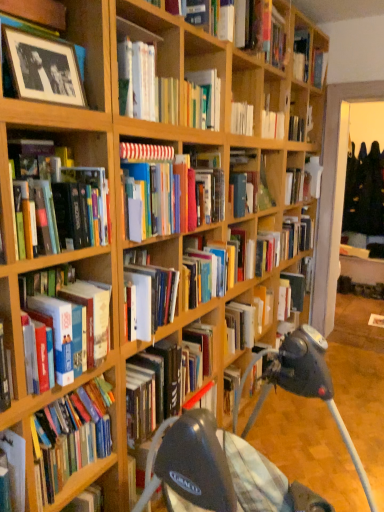
Question: From the image's perspective, is hardcover books at left, the 9th book viewed from the top, over wooden bookshelf at lower left?

Choices:
 (A) yes
 (B) no

Answer: (A)

Question: Is hardcover books at left, the 5th book when ordered from bottom to top, closer to the viewer compared to wooden bookshelf at lower left?

Choices:
 (A) no
 (B) yes

Answer: (B)

Question: Considering the relative positions of hardcover books at left, the 9th book viewed from the top, and wooden bookshelf at lower left in the image provided, is hardcover books at left, the 9th book viewed from the top, to the right of wooden bookshelf at lower left from the viewer's perspective?

Choices:
 (A) yes
 (B) no

Answer: (B)

Question: From a real-world perspective, is hardcover books at left, the 9th book viewed from the top, located beneath wooden bookshelf at lower left?

Choices:
 (A) yes
 (B) no

Answer: (B)

Question: Can we say hardcover books at left, the 9th book viewed from the top, lies outside wooden bookshelf at lower left?

Choices:
 (A) yes
 (B) no

Answer: (A)

Question: From a real-world perspective, is multicolored hardcover books at center, marked as the 7th book in a bottom-to-top arrangement, above or below hardcover books at left, the 9th book viewed from the top?

Choices:
 (A) above
 (B) below

Answer: (A)

Question: Considering their positions, is multicolored hardcover books at center, arranged as the 7th book when viewed from the top, located in front of or behind hardcover books at left, the 5th book when ordered from bottom to top?

Choices:
 (A) front
 (B) behind

Answer: (B)

Question: From the image's perspective, is multicolored hardcover books at center, marked as the 7th book in a bottom-to-top arrangement, above or below hardcover books at left, the 5th book when ordered from bottom to top?

Choices:
 (A) below
 (B) above

Answer: (B)

Question: Based on their sizes in the image, would you say multicolored hardcover books at center, arranged as the 7th book when viewed from the top, is bigger or smaller than hardcover books at left, the 5th book when ordered from bottom to top?

Choices:
 (A) small
 (B) big

Answer: (B)

Question: Is black plastic baby carriage at center taller or shorter than hardcover book at left, arranged as the 4th book when ordered from the bottom?

Choices:
 (A) short
 (B) tall

Answer: (A)

Question: Would you say black plastic baby carriage at center is inside or outside hardcover book at left, arranged as the 4th book when ordered from the bottom?

Choices:
 (A) outside
 (B) inside

Answer: (A)

Question: In the image, is black plastic baby carriage at center positioned in front of or behind hardcover book at left, placed as the 10th book when sorted from top to bottom?

Choices:
 (A) front
 (B) behind

Answer: (B)

Question: From a real-world perspective, is black plastic baby carriage at center above or below hardcover book at left, arranged as the 4th book when ordered from the bottom?

Choices:
 (A) below
 (B) above

Answer: (A)

Question: Considering their positions, is black matte photo frame at upper left, placed as the tenth book when sorted from bottom to top, located in front of or behind wooden bookshelf at lower left?

Choices:
 (A) behind
 (B) front

Answer: (B)

Question: From the image's perspective, is black matte photo frame at upper left, arranged as the 4th book when viewed from the top, located above or below wooden bookshelf at lower left?

Choices:
 (A) above
 (B) below

Answer: (A)